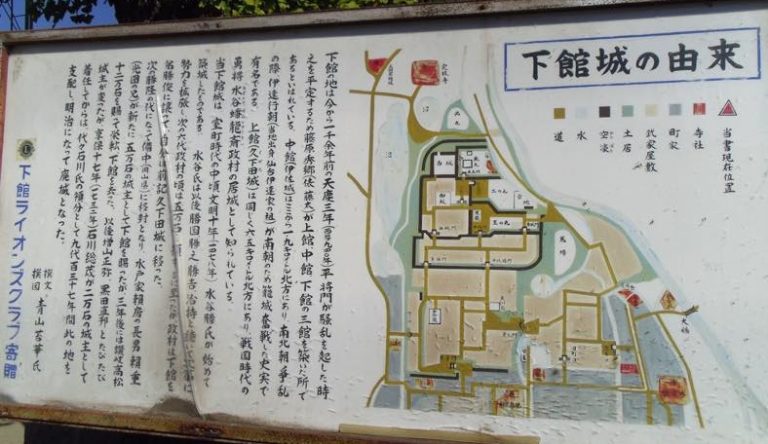
Where is `metal frame`? This screenshot has height=444, width=768. metal frame is located at coordinates (123, 33).